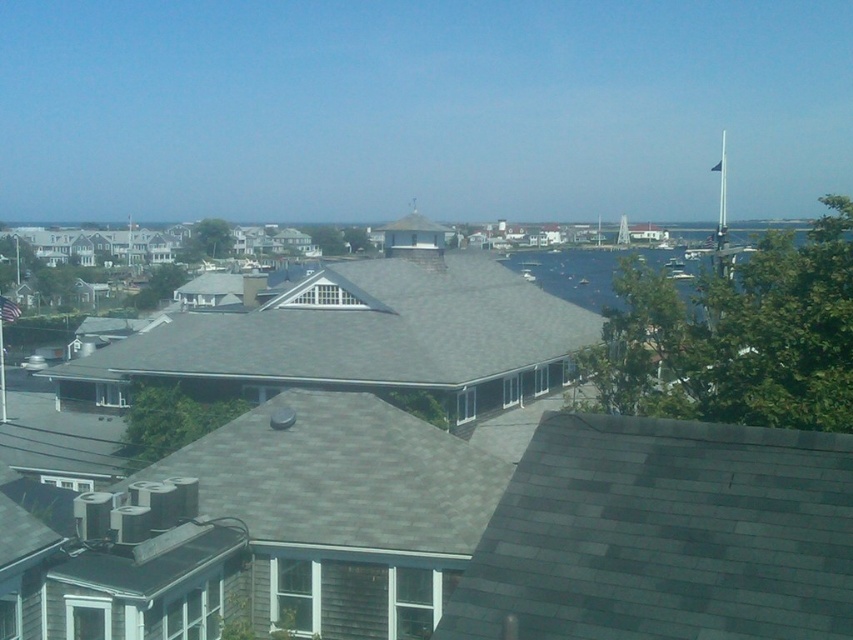
Can you confirm if gray shingles at center is smaller than dark blue water at right?

Yes, gray shingles at center is smaller than dark blue water at right.

Which is below, gray shingles at center or dark blue water at right?

gray shingles at center is below.

Is point (322, 358) behind point (846, 237)?

Yes, point (322, 358) is farther from viewer.

Where is `gray shingles at center`? This screenshot has height=640, width=853. gray shingles at center is located at coordinates (363, 330).